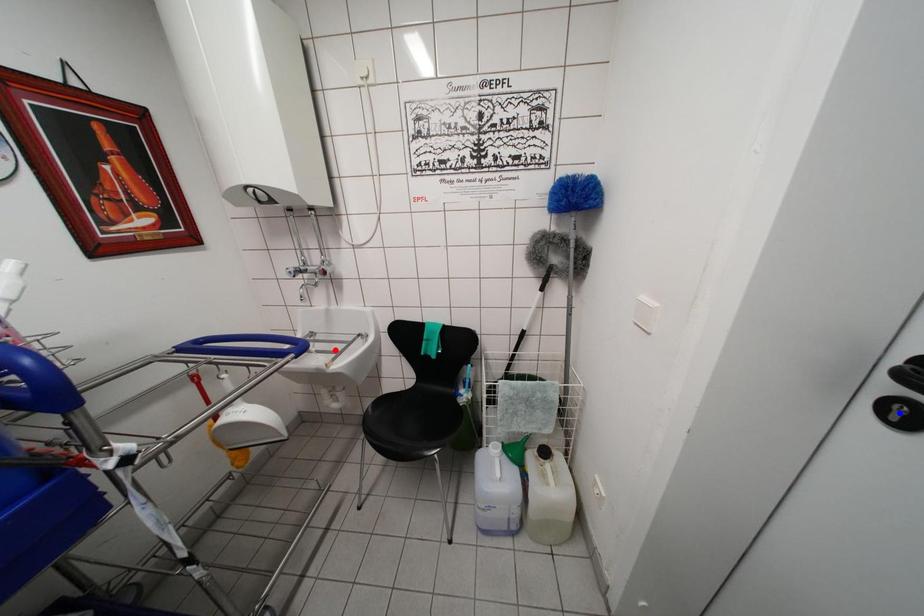
Question: Two points are marked on the image. Which point is closer to the camera?

Choices:
 (A) Blue point is closer.
 (B) Red point is closer.

Answer: (A)